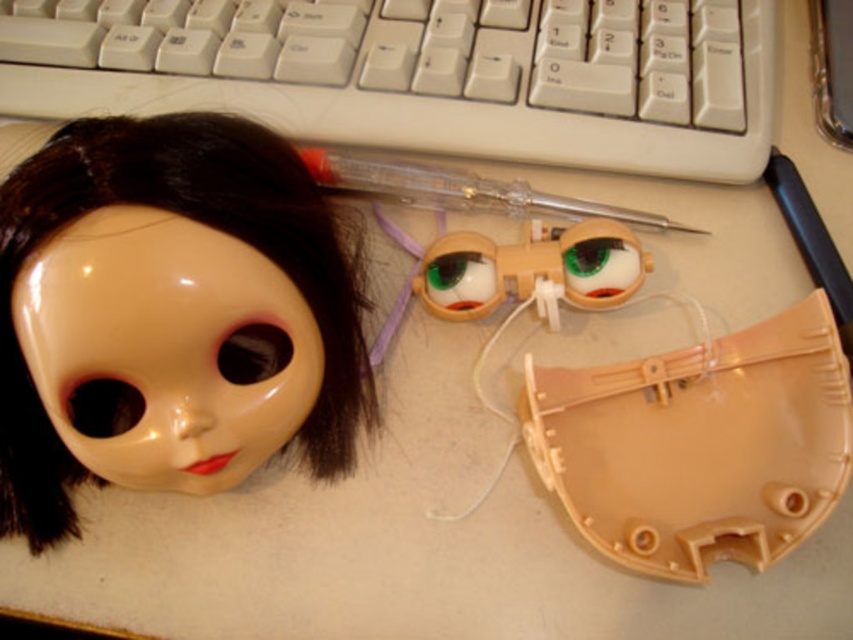
Can you confirm if translucent plastic goggles at center is smaller than transparent plastic pen at center?

Indeed, translucent plastic goggles at center has a smaller size compared to transparent plastic pen at center.

Between point (570, 285) and point (483, 177), which one is positioned in front?

Point (570, 285) is more forward.

Identify the location of translucent plastic goggles at center. This screenshot has width=853, height=640. (531, 268).

Is glossy plastic doll head at upper left further to the viewer compared to translucent plastic goggles at center?

That is False.

This screenshot has width=853, height=640. Find the location of `glossy plastic doll head at upper left`. glossy plastic doll head at upper left is located at coordinates (170, 316).

Which is more to the left, white plastic keyboard at upper center or transparent plastic pen at center?

From the viewer's perspective, white plastic keyboard at upper center appears more on the left side.

Who is more distant from viewer, (560, 80) or (357, 195)?

The point (560, 80) is behind.

Identify the location of white plastic keyboard at upper center. (422, 74).